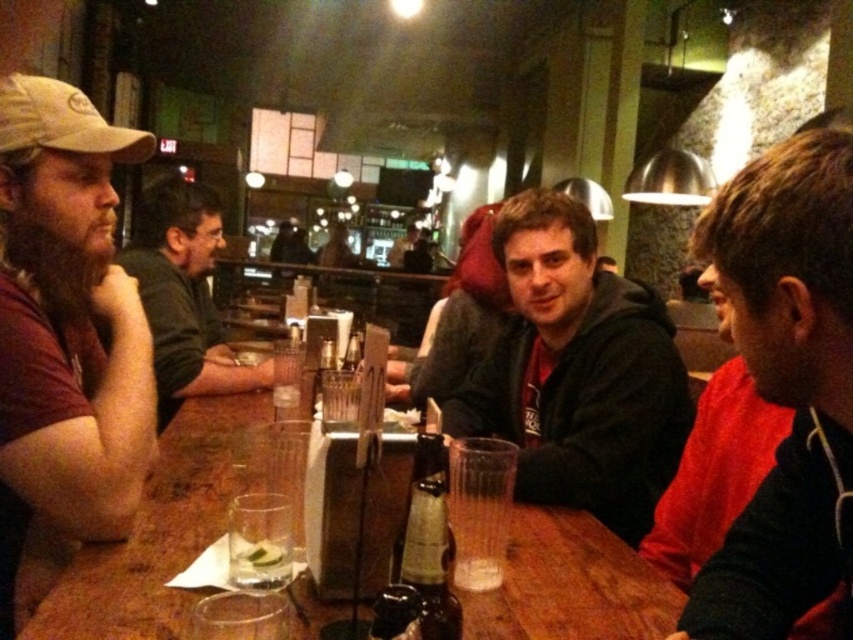
Question: Which object is the farthest from the brown matte cap at left?

Choices:
 (A) red matte shirt at right
 (B) dark green sweater at left

Answer: (A)

Question: In this image, where is dark brown hair at right located relative to dark green sweater at left?

Choices:
 (A) right
 (B) left

Answer: (A)

Question: Which object is closer to the camera taking this photo?

Choices:
 (A) wooden table at center
 (B) dark brown hair at right

Answer: (B)

Question: Can you confirm if brown matte cap at left is positioned to the right of dark brown hair at right?

Choices:
 (A) yes
 (B) no

Answer: (B)

Question: Is dark gray hoodie at center in front of clear plastic cup at table center?

Choices:
 (A) no
 (B) yes

Answer: (A)

Question: Which point appears closest to the camera in this image?

Choices:
 (A) (585, 577)
 (B) (33, 184)

Answer: (A)